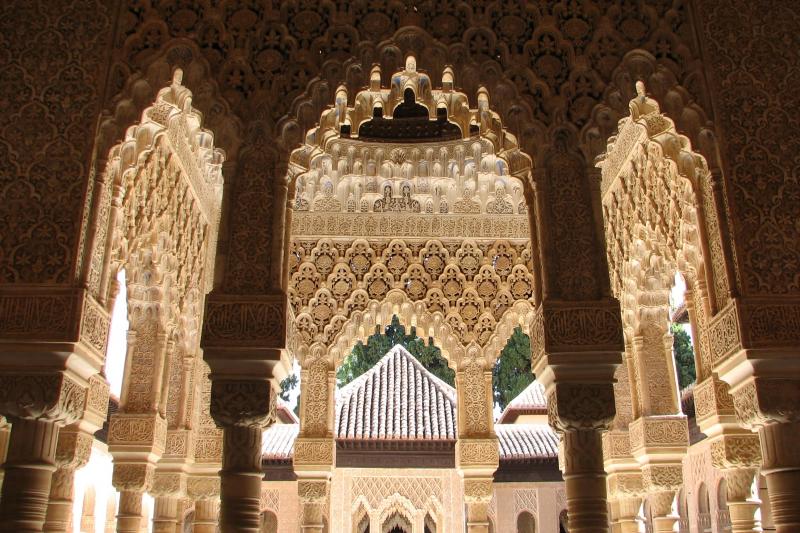
Find the location of `grey columns`. grey columns is located at coordinates (x=585, y=497), (x=234, y=492).